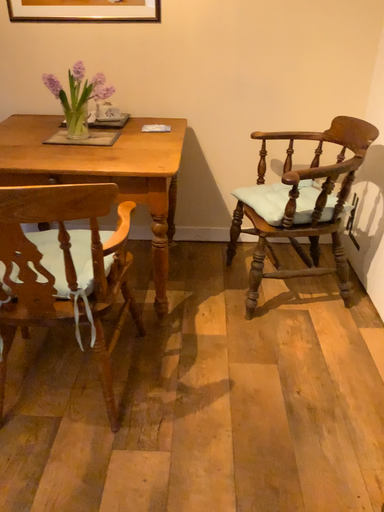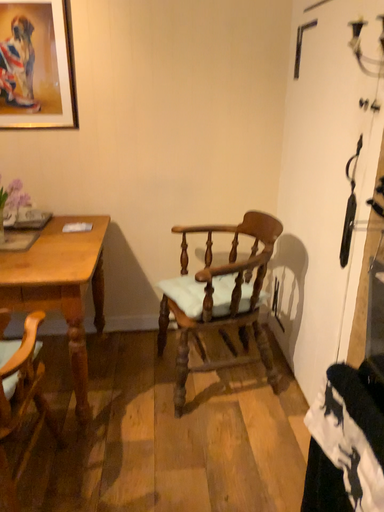
Question: Which way did the camera rotate in the video?

Choices:
 (A) rotated upward
 (B) rotated downward

Answer: (A)